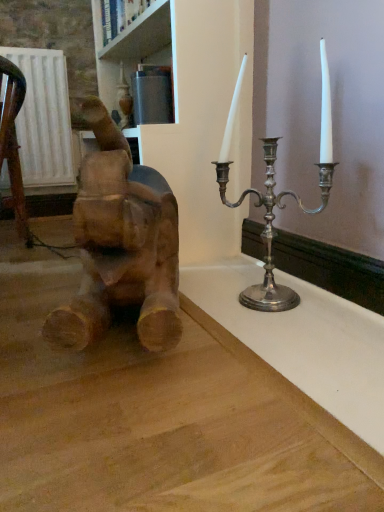
What do you see at coordinates (120, 244) in the screenshot?
I see `wooden elephant at left` at bounding box center [120, 244].

This screenshot has height=512, width=384. What are the coordinates of `wooden elephant at left` in the screenshot? It's located at (120, 244).

Consider the image. In order to face white painted wood at upper center, should I rotate leftwards or rightwards?

A 6.302 degree turn to the left will do.

Describe the element at coordinates (141, 35) in the screenshot. I see `white painted wood at upper center` at that location.

Measure the distance between point (156, 18) and camera.

Point (156, 18) and camera are 1.54 meters apart from each other.

Locate an element on the screen. white painted wood at upper center is located at coordinates tap(141, 35).

I want to click on wooden elephant at left, so click(x=120, y=244).

Can you confirm if white painted wood at upper center is positioned to the left of wooden elephant at left?

Correct, you'll find white painted wood at upper center to the left of wooden elephant at left.

Considering the relative positions of white painted wood at upper center and wooden elephant at left in the image provided, is white painted wood at upper center in front of wooden elephant at left?

No, white painted wood at upper center is further to the viewer.

Looking at this image, which point is more distant from viewer, (x=128, y=38) or (x=152, y=191)?

Point (x=128, y=38)

From the image's perspective, is white painted wood at upper center on top of wooden elephant at left?

Indeed, from the image's perspective, white painted wood at upper center is shown above wooden elephant at left.

From a real-world perspective, is white painted wood at upper center on top of wooden elephant at left?

Yes, from a real-world perspective, white painted wood at upper center is above wooden elephant at left.

Between white painted wood at upper center and wooden elephant at left, which one has smaller width?

white painted wood at upper center.

Between white painted wood at upper center and wooden elephant at left, which one has less height?

white painted wood at upper center is shorter.

Does white painted wood at upper center have a larger size compared to wooden elephant at left?

No, white painted wood at upper center is not bigger than wooden elephant at left.

Would you say wooden elephant at left is part of white painted wood at upper center's contents?

That's incorrect, wooden elephant at left is not inside white painted wood at upper center.

Is white painted wood at upper center not near wooden elephant at left?

Indeed, white painted wood at upper center is not near wooden elephant at left.

Is white painted wood at upper center aimed at wooden elephant at left?

No, white painted wood at upper center is not facing towards wooden elephant at left.

What's the angular difference between white painted wood at upper center and wooden elephant at left's facing directions?

They differ by 19.3 degrees in their facing directions.

Where is `statue (sculpture) lying on the right of white painted wood at upper center`? The image size is (384, 512). statue (sculpture) lying on the right of white painted wood at upper center is located at coordinates (120, 244).

Which object is positioned more to the left, wooden elephant at left or white painted wood at upper center?

white painted wood at upper center.

Which is behind, wooden elephant at left or white painted wood at upper center?

white painted wood at upper center is behind.

Is point (77, 211) less distant than point (130, 30)?

Yes, point (77, 211) is in front of point (130, 30).

From the image's perspective, is wooden elephant at left above white painted wood at upper center?

No.

From a real-world perspective, who is located lower, wooden elephant at left or white painted wood at upper center?

From a 3D spatial view, wooden elephant at left is below.

Is wooden elephant at left thinner than white painted wood at upper center?

No.

Is wooden elephant at left taller than white painted wood at upper center?

Indeed, wooden elephant at left has a greater height compared to white painted wood at upper center.

In terms of size, does wooden elephant at left appear bigger or smaller than white painted wood at upper center?

Considering their sizes, wooden elephant at left takes up more space than white painted wood at upper center.

Is wooden elephant at left situated inside white painted wood at upper center or outside?

wooden elephant at left cannot be found inside white painted wood at upper center.

Would you consider wooden elephant at left to be distant from white painted wood at upper center?

Absolutely, wooden elephant at left is distant from white painted wood at upper center.

Is wooden elephant at left looking in the opposite direction of white painted wood at upper center?

No, wooden elephant at left is not facing away from white painted wood at upper center.

The image size is (384, 512). What are the coordinates of `statue (sculpture) on the right of white painted wood at upper center` in the screenshot? It's located at (120, 244).

Where is `statue (sculpture) below the white painted wood at upper center (from the image's perspective)`? Image resolution: width=384 pixels, height=512 pixels. statue (sculpture) below the white painted wood at upper center (from the image's perspective) is located at coordinates (120, 244).

The image size is (384, 512). Find the location of `statue (sculpture) that is in front of the white painted wood at upper center`. statue (sculpture) that is in front of the white painted wood at upper center is located at coordinates (120, 244).